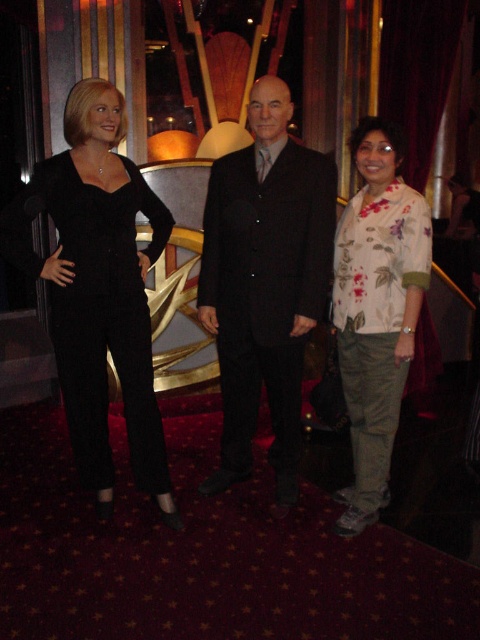
You are standing at the camera position and want to take a photo of the point at coordinates point (279, 228). Is the point within your field of view?

The point (279, 228) is 2.41 meters from the camera, so it is within the field of view.

From the picture: Based on the scene description and the coordinates provided, can you determine the spatial relationship between the black matte jumpsuit at left and the other objects in the image?

The black matte jumpsuit at left is positioned at coordinates point (98, 289), but without additional coordinate data for other objects, the exact spatial relationship cannot be determined.